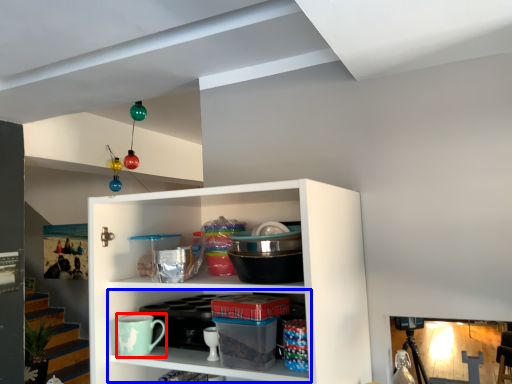
Question: Which of the following is the closest to the observer, mug (highlighted by a red box) or cabinet (highlighted by a blue box)?

Choices:
 (A) mug
 (B) cabinet

Answer: (B)